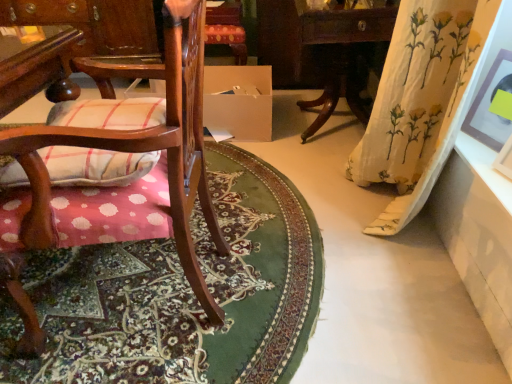
I want to click on vacant area situated below wooden table at right, the 2th table from the left (from a real-world perspective), so click(333, 122).